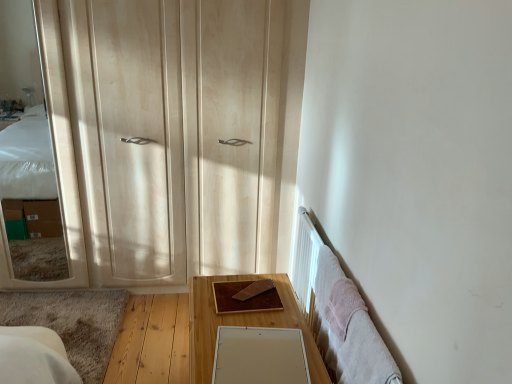
Question: From a real-world perspective, is brown wooden table at center on light wood dresser at left?

Choices:
 (A) no
 (B) yes

Answer: (A)

Question: Can you confirm if brown wooden table at center is wider than light wood dresser at left?

Choices:
 (A) yes
 (B) no

Answer: (A)

Question: Is light wood dresser at left located within brown wooden table at center?

Choices:
 (A) yes
 (B) no

Answer: (B)

Question: Is brown wooden table at center oriented away from light wood dresser at left?

Choices:
 (A) yes
 (B) no

Answer: (B)

Question: Considering the relative positions of brown wooden table at center and light wood dresser at left in the image provided, is brown wooden table at center to the left of light wood dresser at left from the viewer's perspective?

Choices:
 (A) no
 (B) yes

Answer: (A)

Question: Based on their positions, is light wood dresser at left located to the left or right of matte wooden mirror at left, the second mirror ordered from the bottom?

Choices:
 (A) right
 (B) left

Answer: (A)

Question: From a real-world perspective, relative to matte wooden mirror at left, acting as the 1th mirror starting from the left, is light wood dresser at left vertically above or below?

Choices:
 (A) above
 (B) below

Answer: (A)

Question: In terms of width, does light wood dresser at left look wider or thinner when compared to matte wooden mirror at left, placed as the first mirror when sorted from top to bottom?

Choices:
 (A) thin
 (B) wide

Answer: (B)

Question: Is point (273, 94) closer or farther from the camera than point (70, 195)?

Choices:
 (A) closer
 (B) farther

Answer: (A)

Question: Choose the correct answer: Is matte wooden mirror at left, the 2th mirror viewed from the right, inside light wood dresser at left or outside it?

Choices:
 (A) outside
 (B) inside

Answer: (A)

Question: Is matte wooden mirror at left, the second mirror ordered from the bottom, to the left or to the right of light wood dresser at left in the image?

Choices:
 (A) right
 (B) left

Answer: (B)

Question: From the image's perspective, relative to light wood dresser at left, is matte wooden mirror at left, the second mirror ordered from the bottom, above or below?

Choices:
 (A) above
 (B) below

Answer: (B)

Question: In terms of size, does matte wooden mirror at left, arranged as the second mirror when viewed from the front, appear bigger or smaller than light wood dresser at left?

Choices:
 (A) small
 (B) big

Answer: (A)

Question: In terms of size, does white matte mirror at lower center, which appears as the second mirror when viewed from the top, appear bigger or smaller than brown wooden table at center?

Choices:
 (A) big
 (B) small

Answer: (B)

Question: In the image, is white matte mirror at lower center, which appears as the 2th mirror when viewed from the back, on the left side or the right side of brown wooden table at center?

Choices:
 (A) right
 (B) left

Answer: (A)